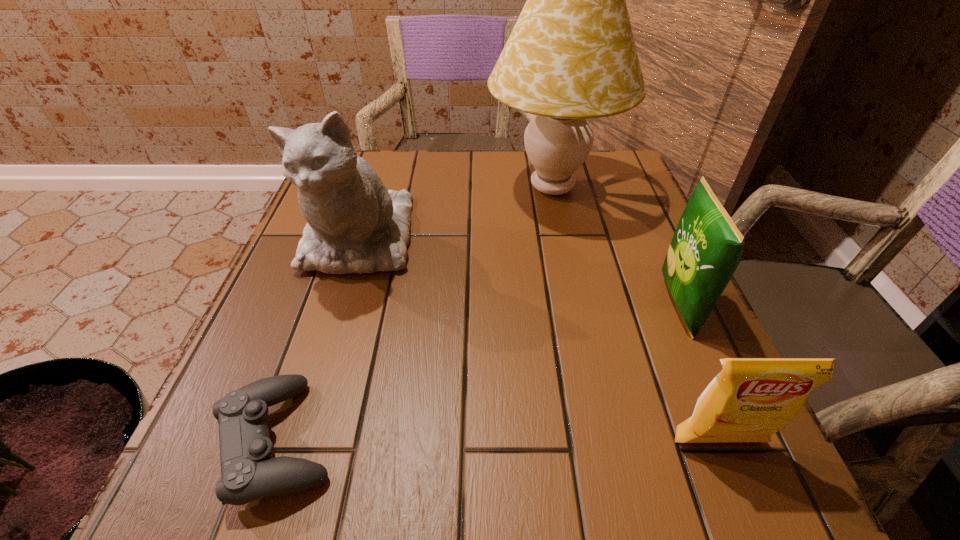
What are the coordinates of `object that is at the near left corner` in the screenshot? It's located at (249, 472).

You are a GUI agent. You are given a task and a screenshot of the screen. Output one action in this format:
    pyautogui.click(x=<x>, y=<y>)
    Task: Click on the object that is positioned at the far right corner
    
    Given the screenshot: What is the action you would take?
    pyautogui.click(x=571, y=56)

Where is `object at the near right corner`? This screenshot has height=540, width=960. object at the near right corner is located at coordinates tap(750, 399).

You are a GUI agent. You are given a task and a screenshot of the screen. Output one action in this format:
    pyautogui.click(x=<x>, y=<y>)
    Task: Click on the vacant space at the far edge of the desktop
    This screenshot has height=540, width=960.
    Given the screenshot: What is the action you would take?
    pyautogui.click(x=525, y=161)

I want to click on vacant region at the near edge of the desktop, so click(x=571, y=500).

Locate an element on the screen. vacant space at the left edge is located at coordinates (252, 358).

You are a GUI agent. You are given a task and a screenshot of the screen. Output one action in this format:
    pyautogui.click(x=<x>, y=<y>)
    Task: Click on the free space at the right edge
    
    Given the screenshot: What is the action you would take?
    pyautogui.click(x=634, y=210)

Identify the location of vacant space at the near left corner of the desktop. 203,502.

Where is `vacant region at the far right corner of the desktop`? The width and height of the screenshot is (960, 540). vacant region at the far right corner of the desktop is located at coordinates (618, 169).

Locate an element on the screen. unoccupied area between the lampshade and the nearer crisp (potato chip) is located at coordinates (635, 315).